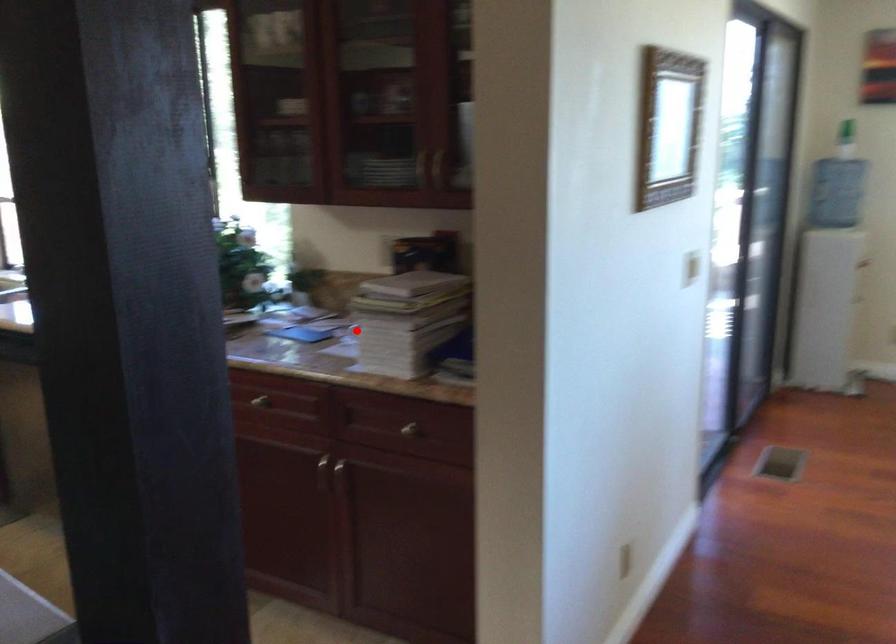
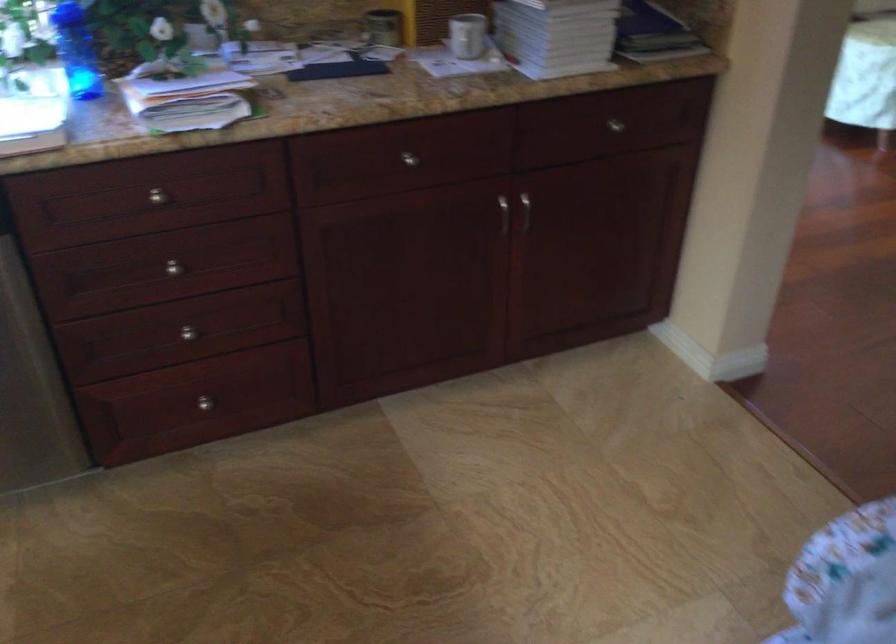
Find the pixel in the second image that matches the highlighted location in the first image.

(467, 35)